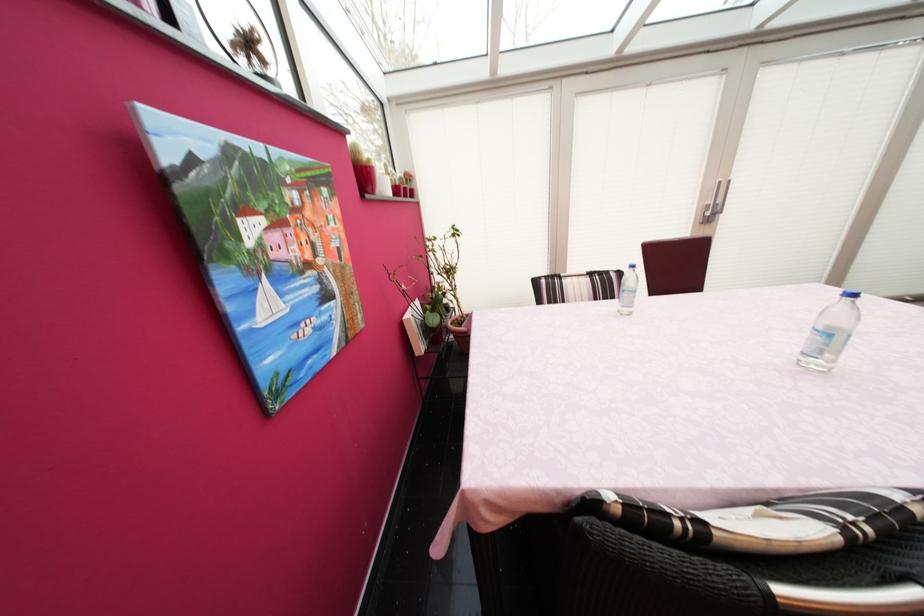
Where would you lift the white book? Please return your answer as a coordinate pair (x, y).

(415, 328)